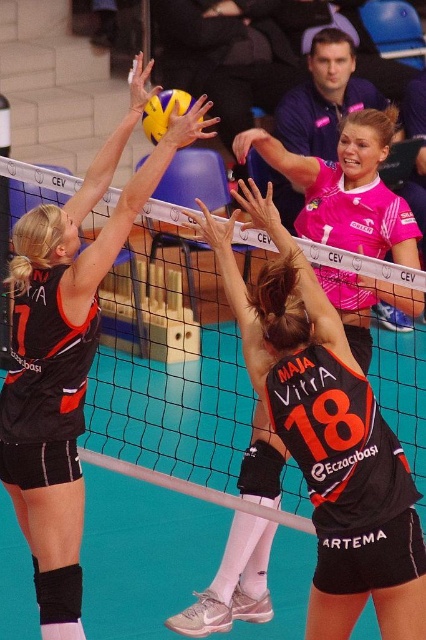
You are a referee observing the volleyball match. You notice the black matte jersey at left and the yellow matte volleyball at upper center. Which object is positioned higher in the image?

The black matte jersey at left has a greater height compared to the yellow matte volleyball at upper center, so the black matte jersey at left is positioned higher in the image.

You are a referee observing the volleyball match. You need to determine if the black matte jersey at left and the yellow matte volleyball at upper center can both fit within a 1.2 meter wide container. Based on their sizes, what is your conclusion?

The black matte jersey at left is wider than the yellow matte volleyball at upper center. However, since the container is 1.2 meters wide, both items can fit as their combined width would be less than the container.

In the volleyball match image, there is a black matte jersey at left. Where exactly is it located in terms of coordinates?

The black matte jersey at left is located at coordinates point (66,355).